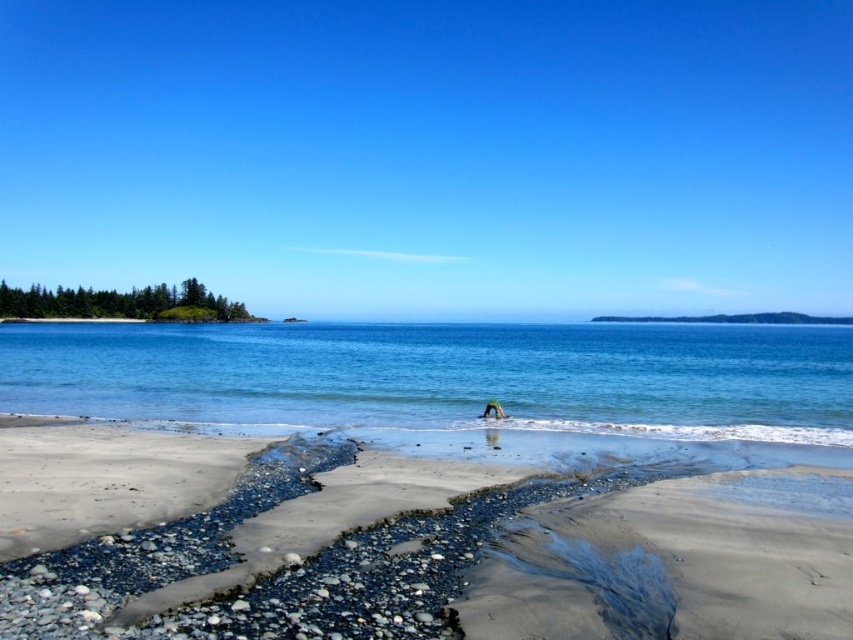
You are standing on the smooth sand beach at center and looking towards the green fabric person at center. Which direction should you walk to reach the person?

The smooth sand beach at center is below the green fabric person at center, so you should walk upwards to reach the person.

You are standing on the beach and see two points marked on the sand. The first point is at coordinates point(x=398, y=636) and the second is at point(x=492, y=401). Which point is closer to you?

Point(x=398, y=636) is closer to the viewer than point(x=492, y=401).